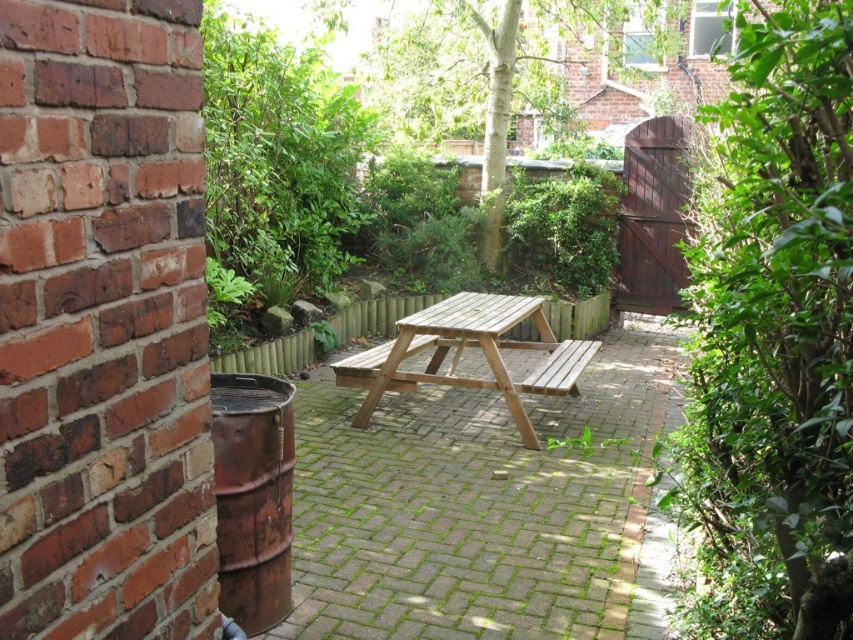
Question: Is wooden picnic table at center further to camera compared to wooden bench at center?

Choices:
 (A) yes
 (B) no

Answer: (B)

Question: Can you confirm if natural wood picnic table at center is positioned to the right of wooden bench at center?

Choices:
 (A) yes
 (B) no

Answer: (B)

Question: Which object appears farthest from the camera in this image?

Choices:
 (A) wooden bench at center
 (B) natural wood picnic table at center
 (C) wooden picnic table at center

Answer: (A)

Question: Which of these objects is positioned farthest from the natural wood picnic table at center?

Choices:
 (A) wooden bench at center
 (B) wooden picnic table at center

Answer: (B)

Question: In this image, where is wooden picnic table at center located relative to natural wood picnic table at center?

Choices:
 (A) above
 (B) below

Answer: (B)

Question: Which object is the farthest from the natural wood picnic table at center?

Choices:
 (A) wooden picnic table at center
 (B) wooden bench at center

Answer: (A)